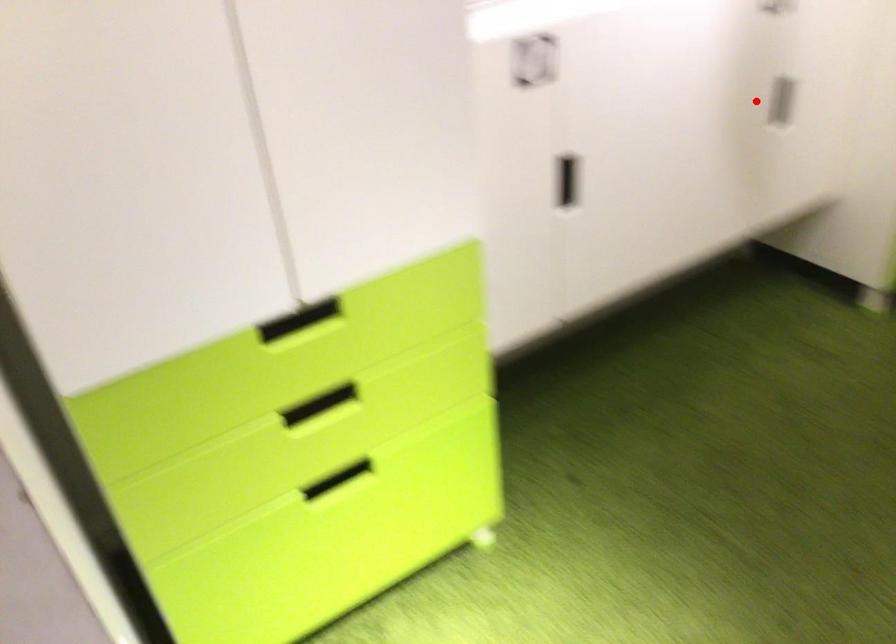
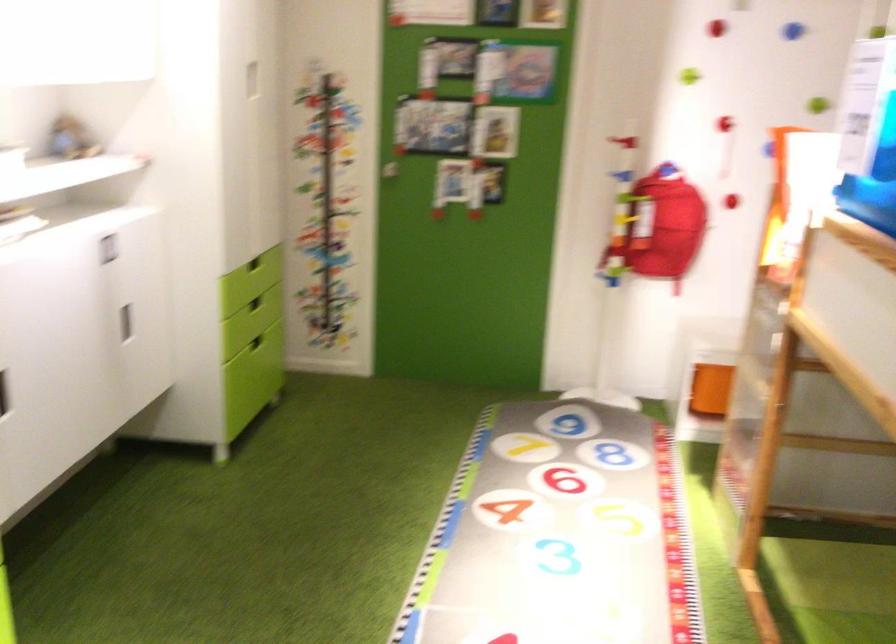
Find the pixel in the second image that matches the highlighted location in the first image.

(125, 323)